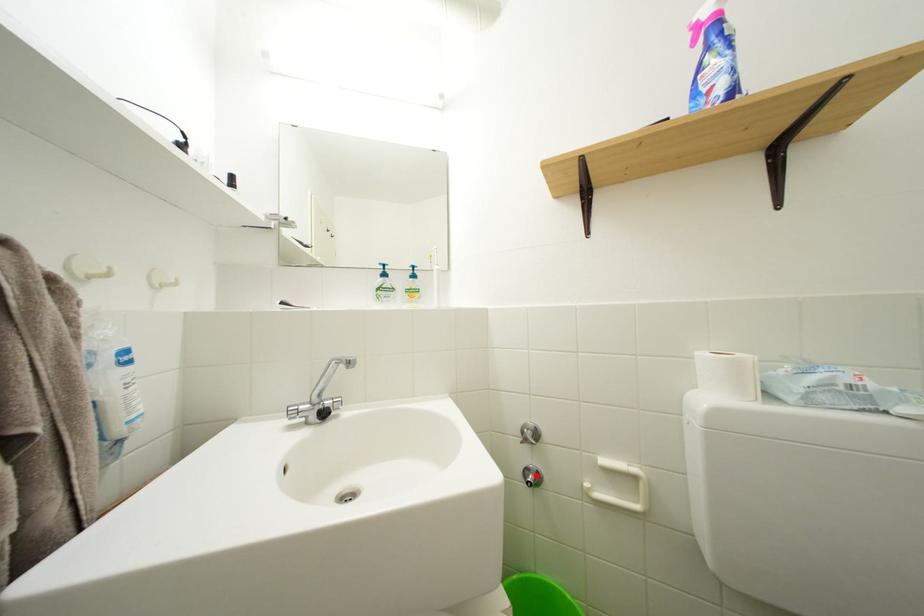
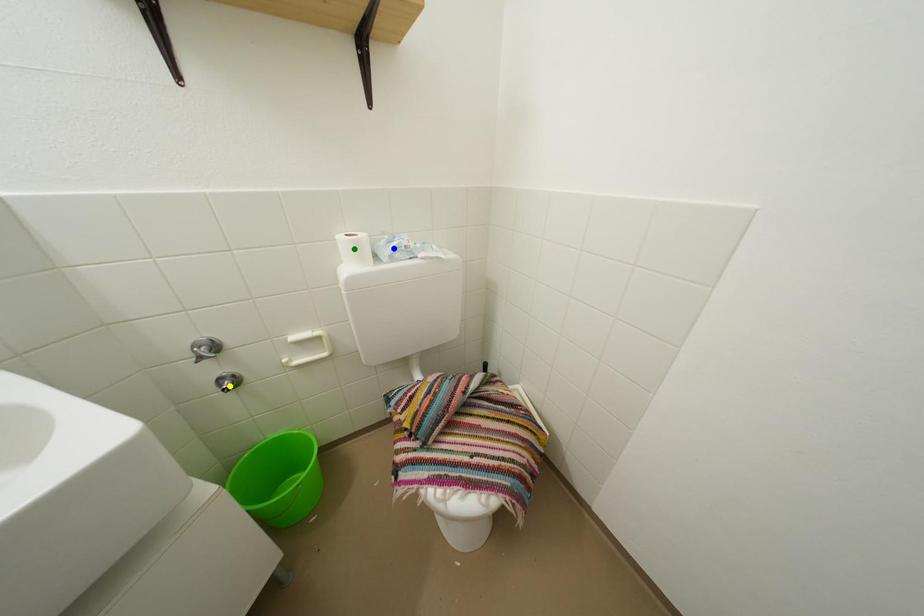
Question: I am providing you with two images of the same scene from different viewpoints. A red point is marked on the first image. You are given multiple points on the second image. Which spot in image 2 lines up with the point in image 1?

Choices:
 (A) green point
 (B) yellow point
 (C) blue point

Answer: (B)